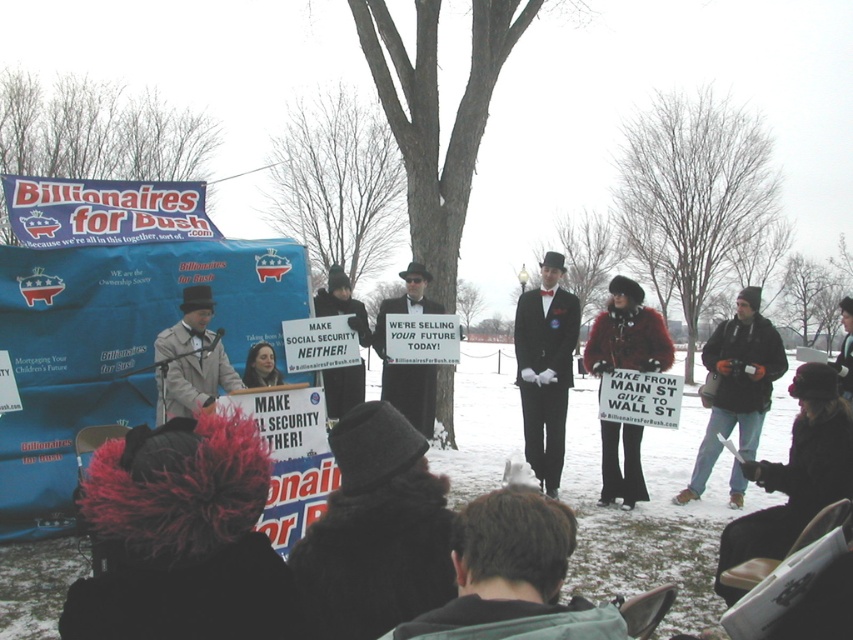
Identify the location of shiny black suit at center. (544, 368).

Does shiny black suit at center have a greater width compared to matte gray coat at center?

In fact, shiny black suit at center might be narrower than matte gray coat at center.

Does point (534, 380) lie behind point (184, 340)?

Yes, it is behind point (184, 340).

Where is `shiny black suit at center`? This screenshot has width=853, height=640. shiny black suit at center is located at coordinates (544, 368).

Can you confirm if matte gray coat at center is positioned below black suit coat at center?

Yes.

The width and height of the screenshot is (853, 640). I want to click on matte gray coat at center, so coord(190,358).

Identify the location of matte gray coat at center. (190, 358).

Who is lower down, black wool jacket at lower right or matte gray coat at center?

black wool jacket at lower right is below.

Between black wool jacket at lower right and matte gray coat at center, which one is positioned higher?

matte gray coat at center is above.

Is point (755, 339) farther from viewer compared to point (172, 336)?

Yes, it is.

I want to click on black wool jacket at lower right, so click(735, 385).